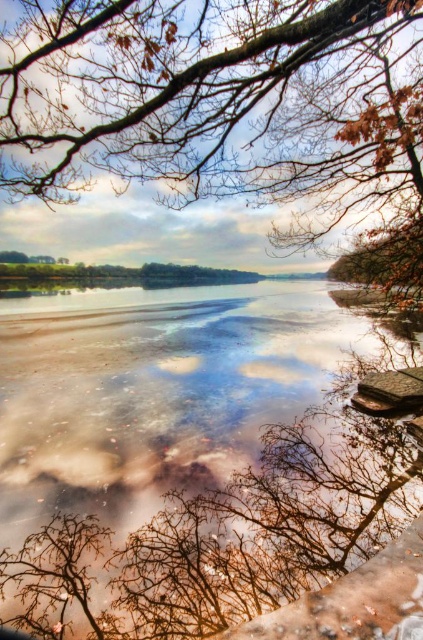
You are an artist trying to sketch this lakeside scene. You want to ensure the proportions between the translucent glass river at center and the brown textured branches at upper center are accurate. Based on the scene, which object should you draw larger in your sketch?

The translucent glass river at center should be drawn larger than the brown textured branches at upper center because it is much taller as stated in the description.